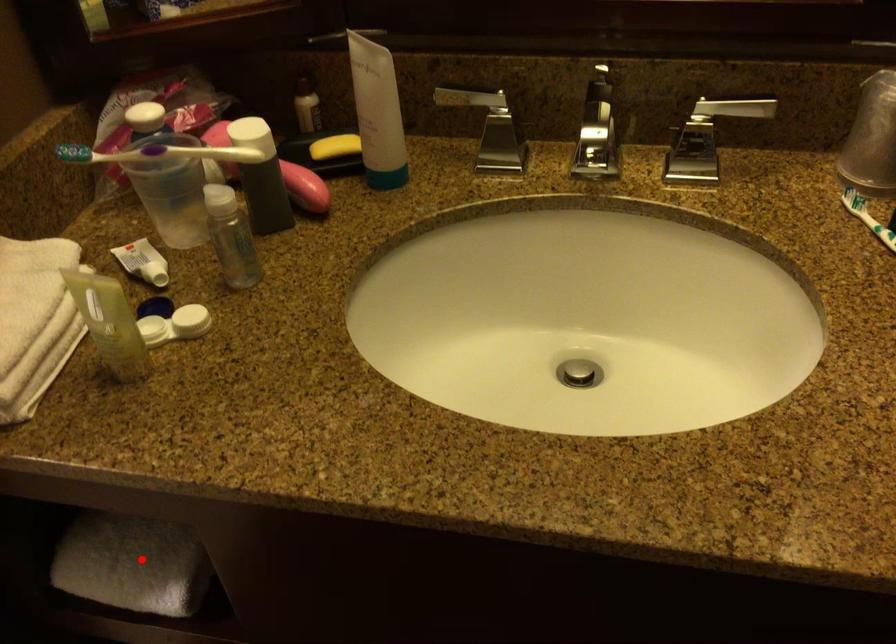
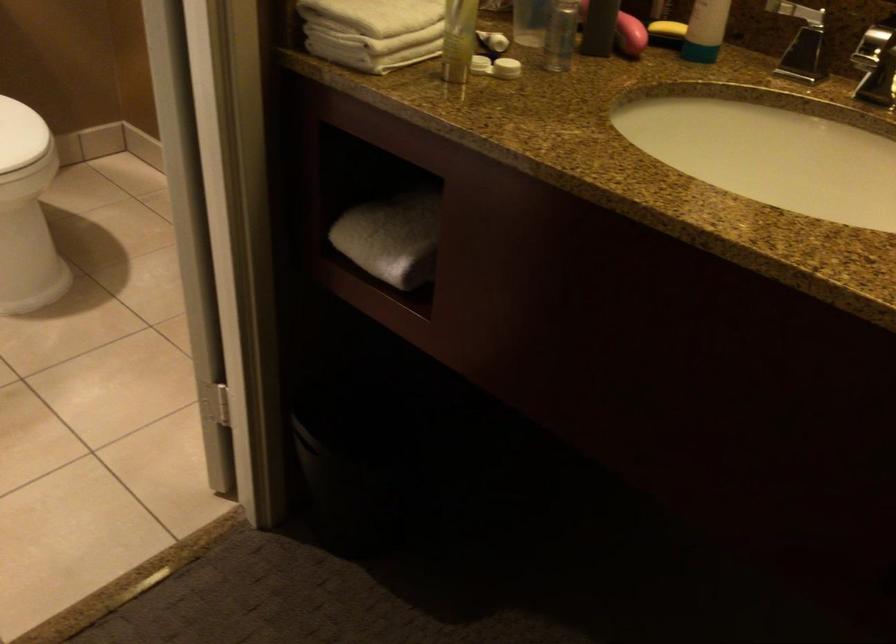
Question: I am providing you with two images of the same scene from different viewpoints. In image1, a red point is highlighted. Considering the same 3D point in image2, which of the following is correct?

Choices:
 (A) It is closer
 (B) It is farther

Answer: (B)